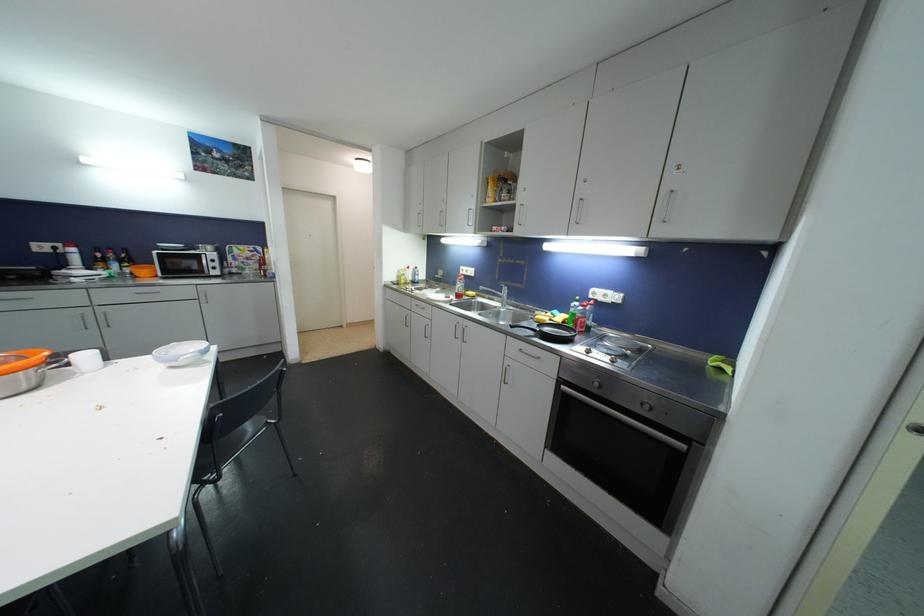
Identify the location of chair sitting surface. This screenshot has width=924, height=616. (235, 439).